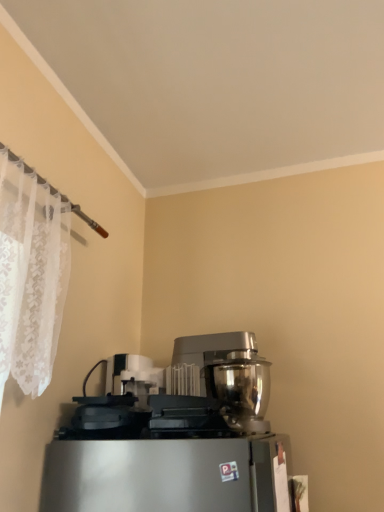
Question: Which direction should I rotate to look at satin silver metallic coffee maker at center?

Choices:
 (A) left
 (B) right

Answer: (B)